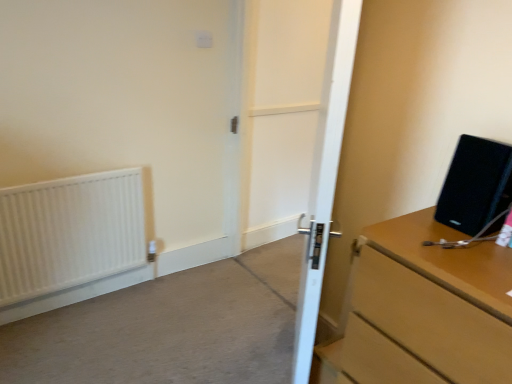
Question: Is white matte radiator at left to the left of white wooden door at center from the viewer's perspective?

Choices:
 (A) yes
 (B) no

Answer: (A)

Question: Would you say white matte radiator at left is outside white wooden door at center?

Choices:
 (A) yes
 (B) no

Answer: (A)

Question: Can you confirm if white matte radiator at left is positioned to the right of white wooden door at center?

Choices:
 (A) no
 (B) yes

Answer: (A)

Question: Is the position of white matte radiator at left less distant than that of white wooden door at center?

Choices:
 (A) yes
 (B) no

Answer: (B)

Question: Can white wooden door at center be found inside white matte radiator at left?

Choices:
 (A) no
 (B) yes

Answer: (A)

Question: Is point [467, 170] closer or farther from the camera than point [82, 192]?

Choices:
 (A) farther
 (B) closer

Answer: (B)

Question: In the image, is black matte speaker at right on the left side or the right side of white matte radiator at left?

Choices:
 (A) right
 (B) left

Answer: (A)

Question: Which is correct: black matte speaker at right is inside white matte radiator at left, or outside of it?

Choices:
 (A) outside
 (B) inside

Answer: (A)

Question: From the image's perspective, is black matte speaker at right above or below white matte radiator at left?

Choices:
 (A) below
 (B) above

Answer: (B)

Question: Considering the positions of wooden chest of drawers at right and black matte speaker at right in the image, is wooden chest of drawers at right taller or shorter than black matte speaker at right?

Choices:
 (A) short
 (B) tall

Answer: (B)

Question: From a real-world perspective, is wooden chest of drawers at right physically located above or below black matte speaker at right?

Choices:
 (A) above
 (B) below

Answer: (B)

Question: Is point (432, 321) positioned closer to the camera than point (463, 205)?

Choices:
 (A) farther
 (B) closer

Answer: (B)

Question: Based on their sizes in the image, would you say wooden chest of drawers at right is bigger or smaller than black matte speaker at right?

Choices:
 (A) big
 (B) small

Answer: (A)

Question: Is point (15, 223) closer or farther from the camera than point (276, 92)?

Choices:
 (A) farther
 (B) closer

Answer: (B)

Question: Is white matte radiator at left bigger or smaller than white wooden door at center?

Choices:
 (A) small
 (B) big

Answer: (A)